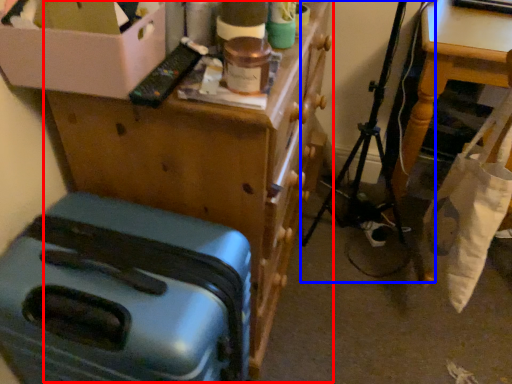
Question: Among these objects, which one is farthest to the camera, furniture (highlighted by a red box) or folding chair (highlighted by a blue box)?

Choices:
 (A) furniture
 (B) folding chair

Answer: (B)